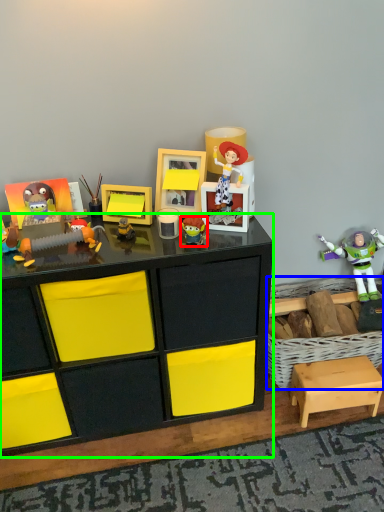
Question: Which object is positioned farthest from toy (highlighted by a red box)? Select from crate (highlighted by a blue box) and desk (highlighted by a green box).

Choices:
 (A) crate
 (B) desk

Answer: (A)